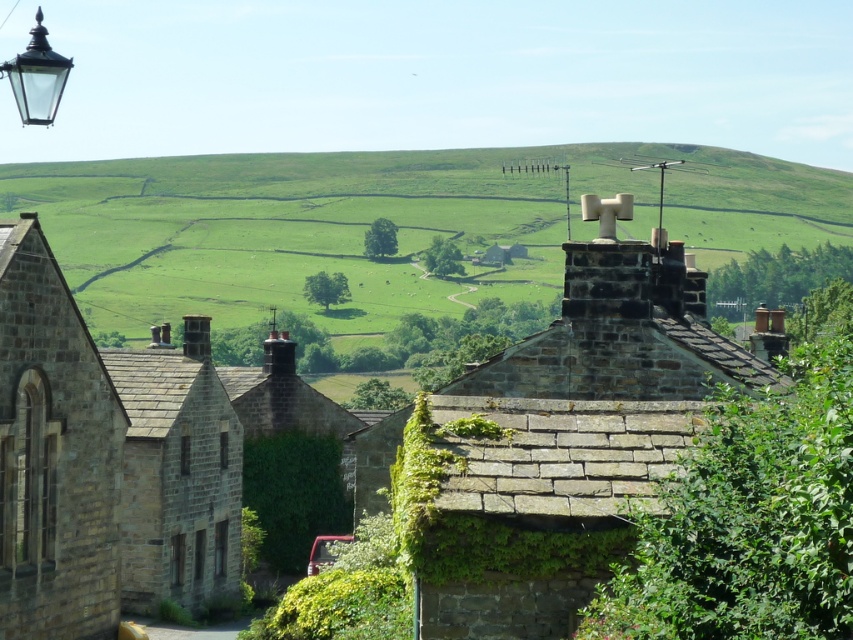
Question: Which object appears farthest from the camera in this image?

Choices:
 (A) stone chimney at center
 (B) matte glass streetlamp at upper left

Answer: (B)

Question: Which of the following is the closest to the observer?

Choices:
 (A) (41, 32)
 (B) (80, 220)

Answer: (A)

Question: Can you confirm if green grassy hillside at upper center is smaller than stone chimney at center?

Choices:
 (A) no
 (B) yes

Answer: (A)

Question: Does green grassy hillside at upper center have a lesser width compared to matte glass streetlamp at upper left?

Choices:
 (A) no
 (B) yes

Answer: (A)

Question: Is green grassy hillside at upper center bigger than stone chimney at center?

Choices:
 (A) no
 (B) yes

Answer: (B)

Question: Which point is closer to the camera?

Choices:
 (A) (36, 49)
 (B) (206, 260)
 (C) (648, 353)

Answer: (A)